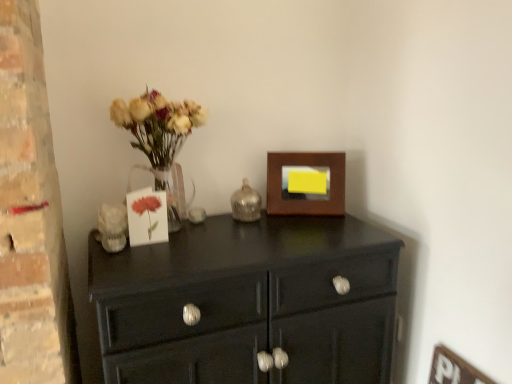
The height and width of the screenshot is (384, 512). In order to click on free space to the right of white matte card at center in this screenshot , I will do `click(212, 242)`.